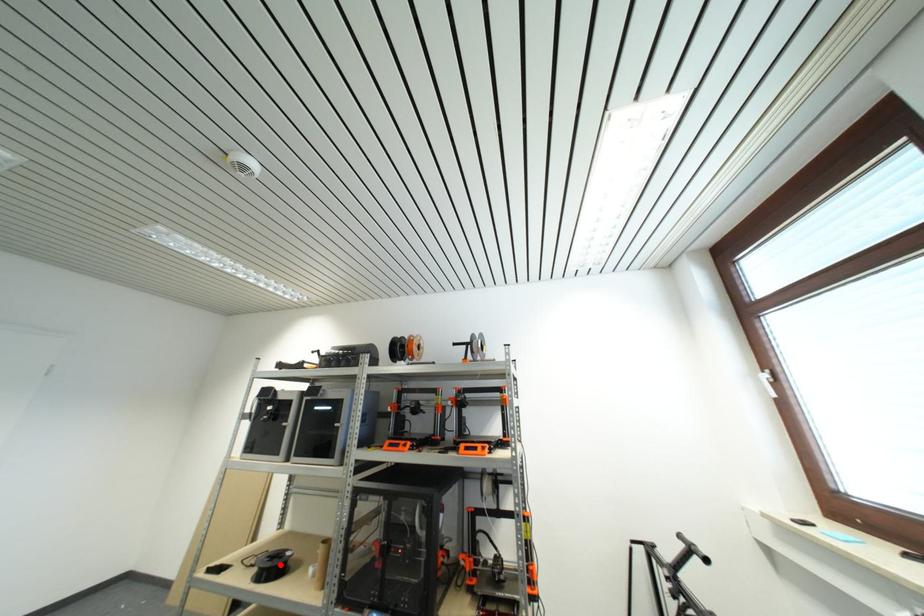
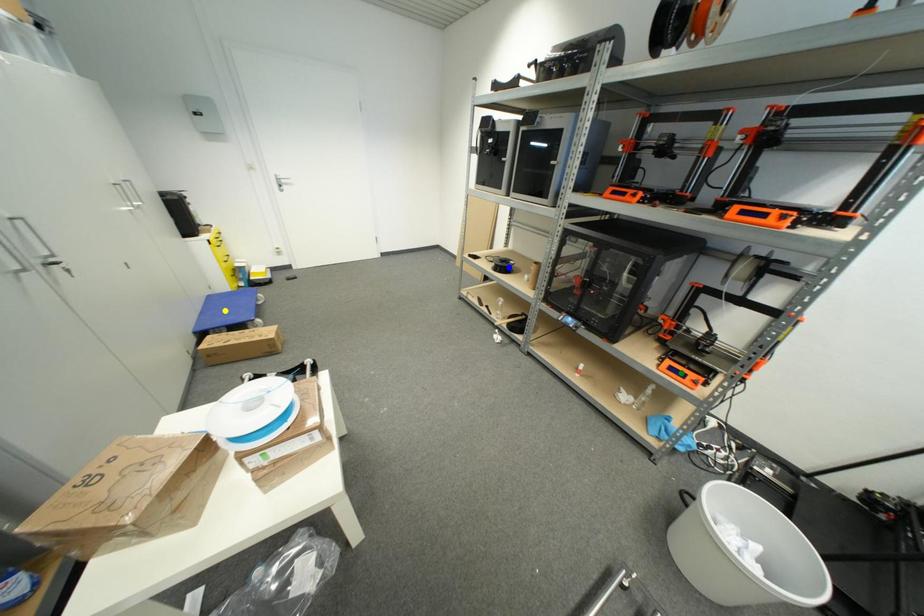
Question: I am providing you with two images of the same scene from different viewpoints. A red point is marked on the first image. You are given multiple points on the second image. Which spot in image 2 lines up with the point in image 1?

Choices:
 (A) yellow point
 (B) blue point
 (C) green point

Answer: (B)